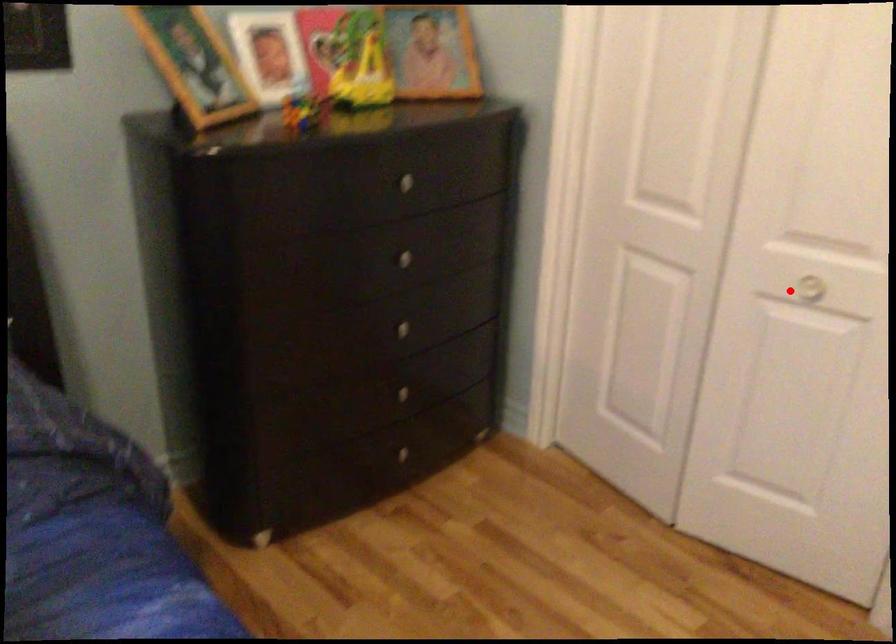
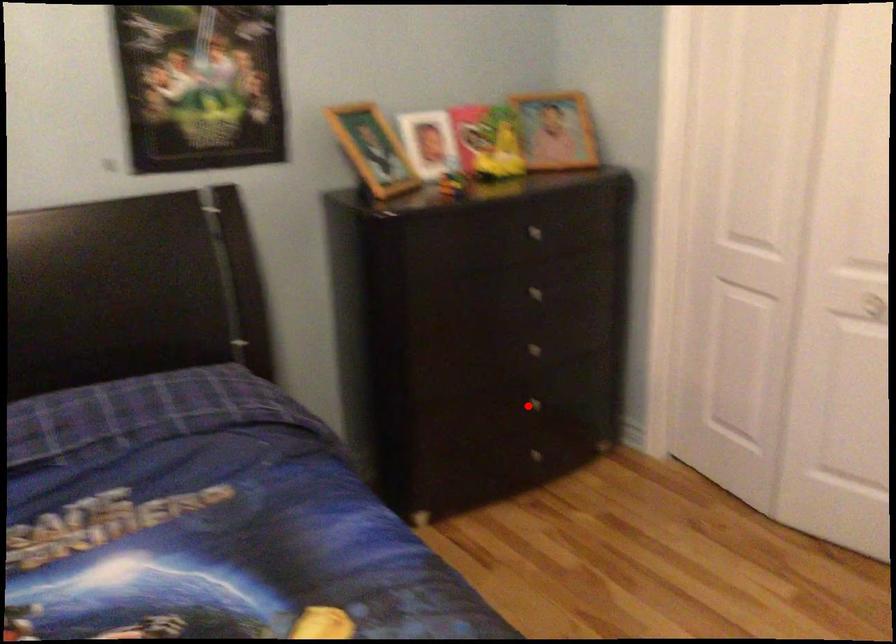
I am providing you with two images of the same scene from different viewpoints. A red point is marked on the first image and another point is marked on the second image. Is the marked point in image1 the same physical position as the marked point in image2?

No